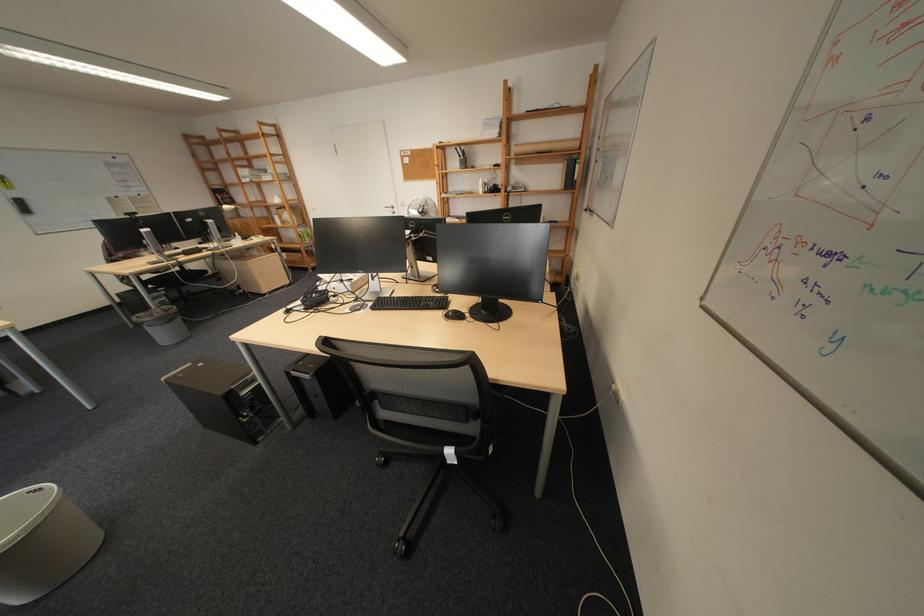
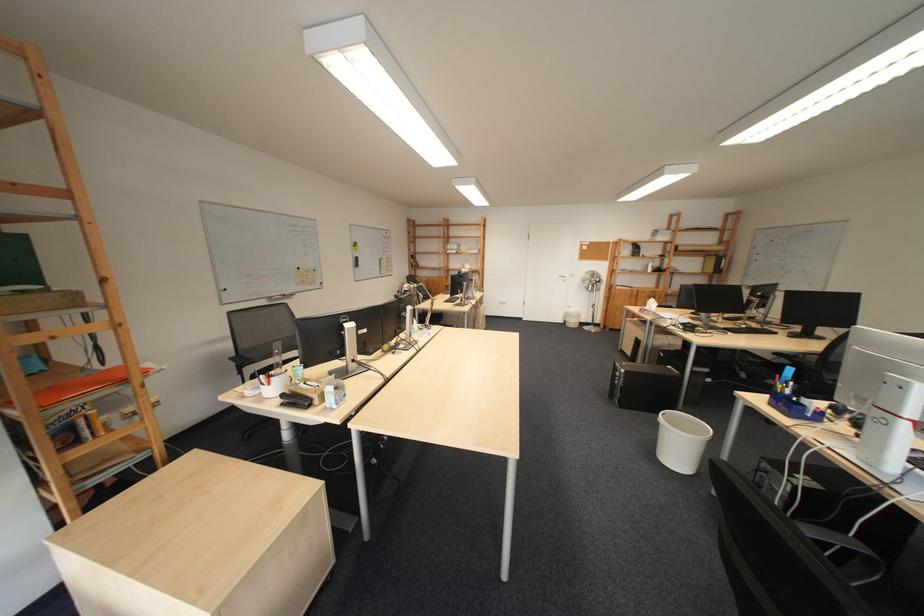
Question: What movement of the cameraman would produce the second image?

Choices:
 (A) Left
 (B) Right
 (C) Forward
 (D) Backward

Answer: (A)